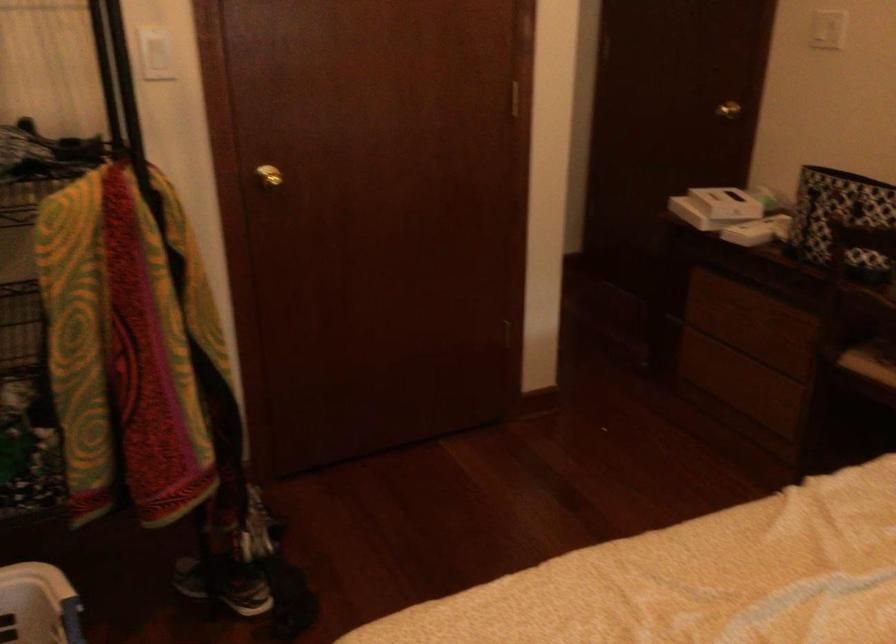
Image resolution: width=896 pixels, height=644 pixels. Find the location of `white light switch`. white light switch is located at coordinates (156, 55).